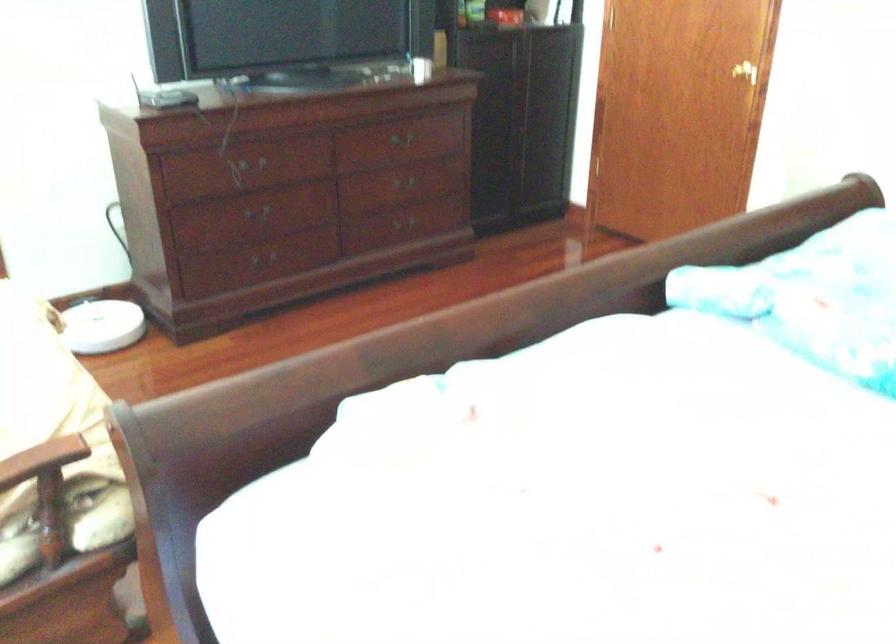
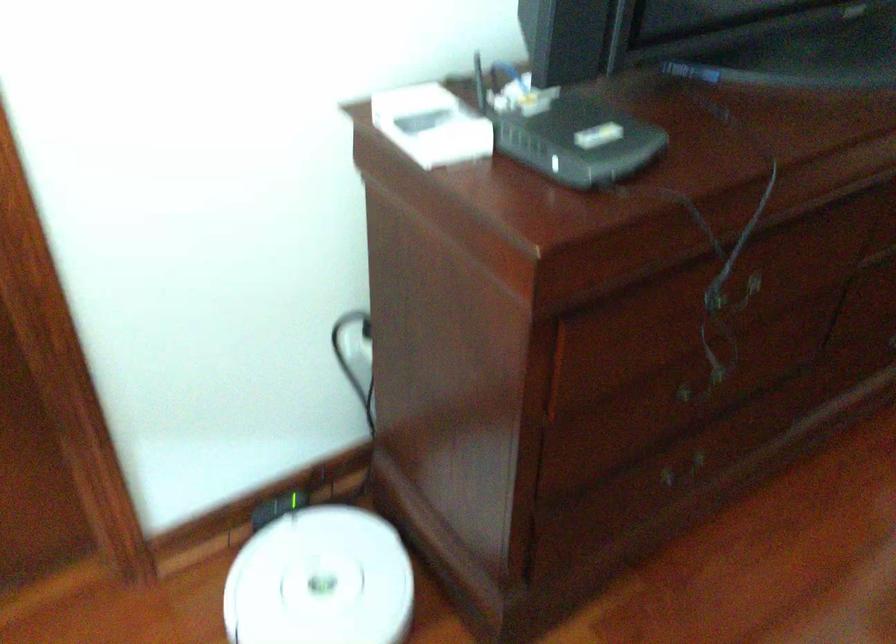
Locate, in the second image, the point that corresponds to (x=92, y=324) in the first image.

(321, 581)